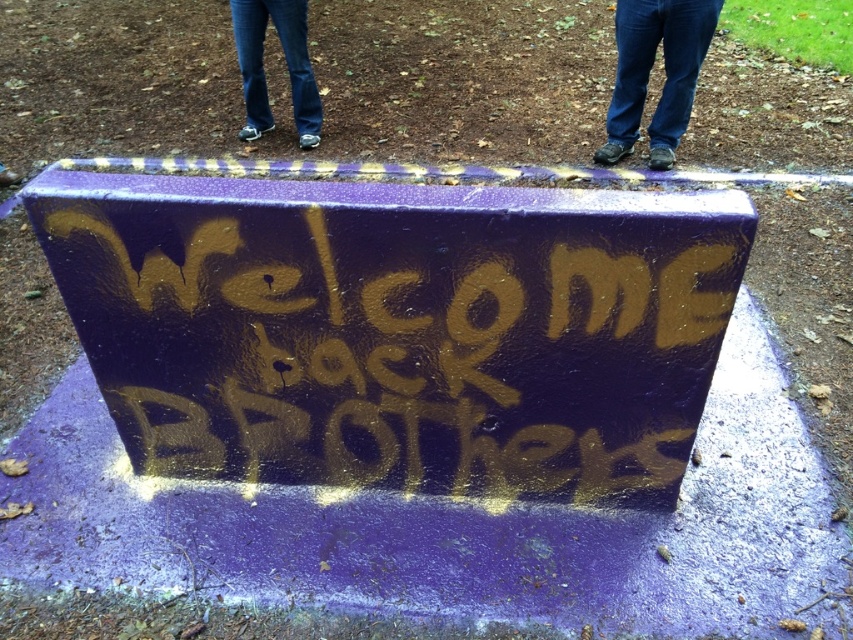
You are a graffiti artist who wants to add a new tag to the gold spray paint graffiti at center and the jeans at center. Which object should you choose if you want to work on the larger one?

The gold spray paint graffiti at center has a larger size compared to jeans at center, so you should choose the gold spray paint graffiti at center to work on the larger one.

You are a painter trying to assess the height of the gold spray paint graffiti at center and the jeans at upper center. Which one is shorter?

The gold spray paint graffiti at center is shorter than the jeans at upper center.

Based on the photo, you are a painter standing at the center of the image. You want to touch both the gold spray paint graffiti at center and the jeans at center with your spray can without moving your feet. Is it possible? Please explain.

The distance between the gold spray paint graffiti at center and the jeans at center is 2.72 meters. Since the spray can can reach up to around 2 meters, you cannot touch both without moving your feet.